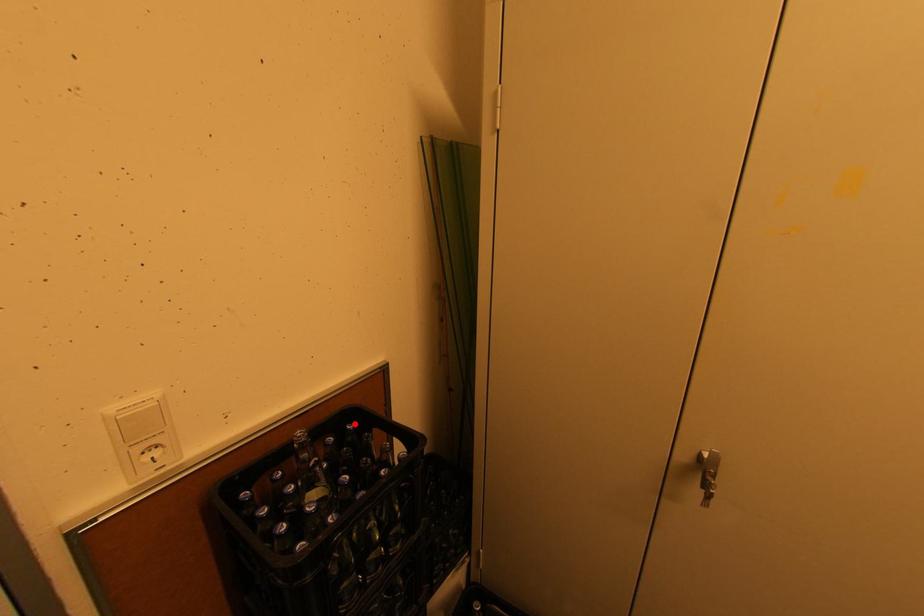
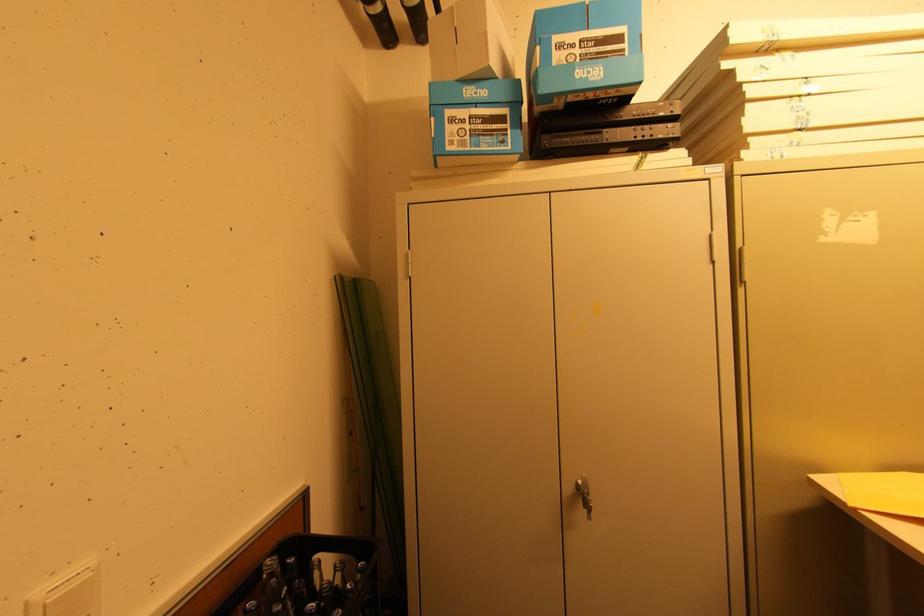
In the second image, find the point that corresponds to the highlighted location in the first image.

(294, 557)